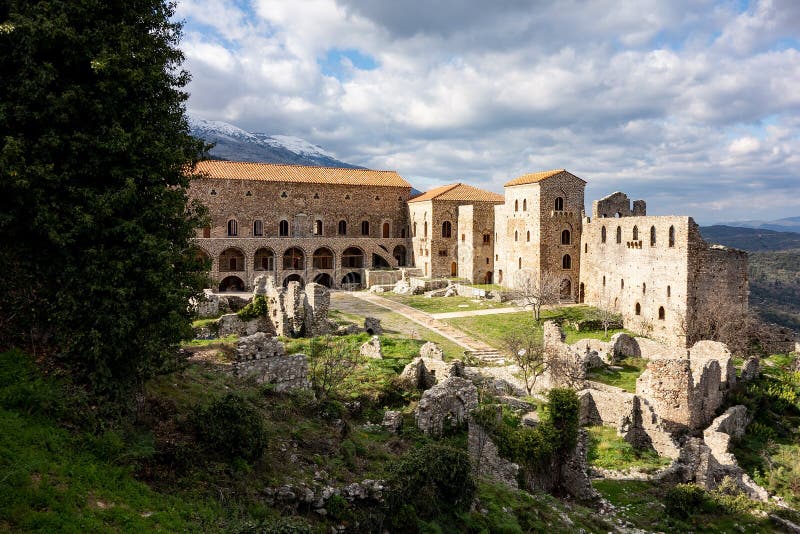
The height and width of the screenshot is (534, 800). Find the location of `balcony door`. balcony door is located at coordinates (561, 201).